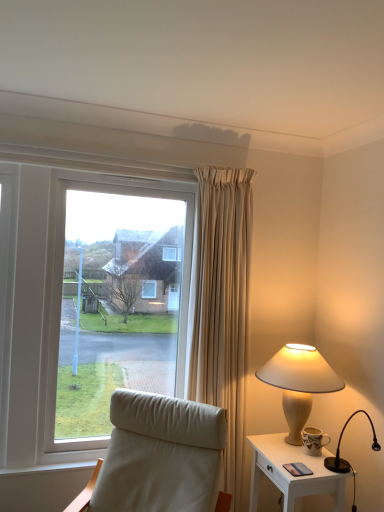
What do you see at coordinates (346, 460) in the screenshot? This screenshot has height=512, width=384. I see `black glossy lamp at right, placed as the 2th lamp when sorted from back to front` at bounding box center [346, 460].

Image resolution: width=384 pixels, height=512 pixels. I want to click on black glossy lamp at right, which is the first lamp in front-to-back order, so click(346, 460).

Could you tell me if white glossy nightstand at lower right is turned towards leather-like chair at lower left?

Yes.

Is white glossy nightstand at lower right positioned behind leather-like chair at lower left?

Yes.

Is point (287, 504) positioned after point (89, 506)?

Yes.

From the image's perspective, is black glossy lamp at right, placed as the 2th lamp when sorted from back to front, located beneath white glossy nightstand at lower right?

Actually, black glossy lamp at right, placed as the 2th lamp when sorted from back to front, appears above white glossy nightstand at lower right in the image.

Considering the positions of point (339, 447) and point (322, 455), is point (339, 447) closer or farther from the camera than point (322, 455)?

Point (339, 447) is farther from the camera than point (322, 455).

Which of these two, black glossy lamp at right, which is the first lamp in front-to-back order, or white glossy nightstand at lower right, is thinner?

With smaller width is white glossy nightstand at lower right.

Considering the relative sizes of leather-like chair at lower left and white glossy nightstand at lower right in the image provided, is leather-like chair at lower left bigger than white glossy nightstand at lower right?

Yes.

How much distance is there between leather-like chair at lower left and white glossy nightstand at lower right?

leather-like chair at lower left is 20.94 inches from white glossy nightstand at lower right.

In the image, there is a leather-like chair at lower left. At what (x,y) coordinates should I click in order to perform the action: click on nightstand below it (from the image's perspective). Please return your answer as a coordinate pair (x, y). The image size is (384, 512). Looking at the image, I should click on (290, 474).

Can you tell me how much leather-like chair at lower left and white glossy nightstand at lower right differ in facing direction?

There is a 47.5-degree angle between the facing directions of leather-like chair at lower left and white glossy nightstand at lower right.

Does white glossy nightstand at lower right have a larger size compared to black glossy lamp at right, which is the first lamp in front-to-back order?

Yes.

From a real-world perspective, starting from the white glossy nightstand at lower right, which lamp is the 1st one vertically above it? Please provide its 2D coordinates.

[(346, 460)]

From the image's perspective, between white glossy nightstand at lower right and black glossy lamp at right, placed as the 2th lamp when sorted from back to front, who is located below?

From the image's view, white glossy nightstand at lower right is below.

What's the angular difference between white glossy nightstand at lower right and black glossy lamp at right, which is the first lamp in front-to-back order,'s facing directions?

There is a 67-degree angle between the facing directions of white glossy nightstand at lower right and black glossy lamp at right, which is the first lamp in front-to-back order.

Is leather-like chair at lower left next to matte beige lamp at right, which ranks as the 2th lamp in front-to-back order?

No, leather-like chair at lower left is not making contact with matte beige lamp at right, which ranks as the 2th lamp in front-to-back order.

Considering the positions of point (190, 404) and point (304, 397), is point (190, 404) closer or farther from the camera than point (304, 397)?

Point (190, 404).

How distant is leather-like chair at lower left from matte beige lamp at right, which ranks as the 2th lamp in front-to-back order?

A distance of 23.79 inches exists between leather-like chair at lower left and matte beige lamp at right, which ranks as the 2th lamp in front-to-back order.

In the scene shown: Would you say leather-like chair at lower left is outside matte beige lamp at right, marked as the 1th lamp in a back-to-front arrangement?

leather-like chair at lower left lies outside matte beige lamp at right, marked as the 1th lamp in a back-to-front arrangement,'s area.

Between matte beige lamp at right, which ranks as the 2th lamp in front-to-back order, and white glossy nightstand at lower right, which one has larger size?

white glossy nightstand at lower right is bigger.

In the scene shown: Can we say matte beige lamp at right, which ranks as the 2th lamp in front-to-back order, lies outside white glossy nightstand at lower right?

Yes.

Considering the positions of objects matte beige lamp at right, which ranks as the 2th lamp in front-to-back order, and white glossy nightstand at lower right in the image provided, who is more to the left, matte beige lamp at right, which ranks as the 2th lamp in front-to-back order, or white glossy nightstand at lower right?

Positioned to the left is white glossy nightstand at lower right.

Are matte beige lamp at right, marked as the 1th lamp in a back-to-front arrangement, and white glossy nightstand at lower right located far from each other?

No, matte beige lamp at right, marked as the 1th lamp in a back-to-front arrangement, is not far from white glossy nightstand at lower right.

Where is `lamp that is the 1st one above the leather-like chair at lower left (from a real-world perspective)`? This screenshot has height=512, width=384. lamp that is the 1st one above the leather-like chair at lower left (from a real-world perspective) is located at coordinates (346, 460).

Is black glossy lamp at right, placed as the 2th lamp when sorted from back to front, at the right side of leather-like chair at lower left?

Correct, you'll find black glossy lamp at right, placed as the 2th lamp when sorted from back to front, to the right of leather-like chair at lower left.

How many degrees apart are the facing directions of black glossy lamp at right, which is the first lamp in front-to-back order, and leather-like chair at lower left?

The angle between the facing direction of black glossy lamp at right, which is the first lamp in front-to-back order, and the facing direction of leather-like chair at lower left is 19.5 degrees.

Is black glossy lamp at right, which is the first lamp in front-to-back order, situated inside leather-like chair at lower left or outside?

black glossy lamp at right, which is the first lamp in front-to-back order, is located beyond the bounds of leather-like chair at lower left.

In the image, there is a leather-like chair at lower left. Where is `nightstand below it (from the image's perspective)`? The width and height of the screenshot is (384, 512). nightstand below it (from the image's perspective) is located at coordinates (290, 474).

You are a GUI agent. You are given a task and a screenshot of the screen. Output one action in this format:
    pyautogui.click(x=<x>, y=<y>)
    Task: Click on the lamp in front of the white glossy nightstand at lower right
    This screenshot has width=384, height=512.
    Given the screenshot: What is the action you would take?
    pyautogui.click(x=346, y=460)

From the image, which object appears to be farther from white glossy nightstand at lower right, leather-like chair at lower left or black glossy lamp at right, placed as the 2th lamp when sorted from back to front?

leather-like chair at lower left.

Looking at the image, which one is located further to black glossy lamp at right, placed as the 2th lamp when sorted from back to front, matte beige lamp at right, marked as the 1th lamp in a back-to-front arrangement, or white glossy nightstand at lower right?

Based on the image, matte beige lamp at right, marked as the 1th lamp in a back-to-front arrangement, appears to be further to black glossy lamp at right, placed as the 2th lamp when sorted from back to front.

When comparing their distances from white glossy nightstand at lower right, does black glossy lamp at right, placed as the 2th lamp when sorted from back to front, or matte beige lamp at right, which ranks as the 2th lamp in front-to-back order, seem further?

The object further to white glossy nightstand at lower right is matte beige lamp at right, which ranks as the 2th lamp in front-to-back order.

In the scene shown: Based on their spatial positions, is leather-like chair at lower left or matte beige lamp at right, which ranks as the 2th lamp in front-to-back order, closer to black glossy lamp at right, placed as the 2th lamp when sorted from back to front?

Among the two, matte beige lamp at right, which ranks as the 2th lamp in front-to-back order, is located nearer to black glossy lamp at right, placed as the 2th lamp when sorted from back to front.

Based on their spatial positions, is matte beige lamp at right, which ranks as the 2th lamp in front-to-back order, or black glossy lamp at right, placed as the 2th lamp when sorted from back to front, closer to white glossy nightstand at lower right?

Based on the image, black glossy lamp at right, placed as the 2th lamp when sorted from back to front, appears to be nearer to white glossy nightstand at lower right.

Looking at the image, which one is located further to leather-like chair at lower left, white glossy nightstand at lower right or black glossy lamp at right, placed as the 2th lamp when sorted from back to front?

black glossy lamp at right, placed as the 2th lamp when sorted from back to front.

Looking at the image, which one is located further to matte beige lamp at right, marked as the 1th lamp in a back-to-front arrangement, white glossy nightstand at lower right or leather-like chair at lower left?

leather-like chair at lower left is positioned further to the anchor matte beige lamp at right, marked as the 1th lamp in a back-to-front arrangement.

Which object lies further to the anchor point leather-like chair at lower left, white glossy nightstand at lower right or matte beige lamp at right, which ranks as the 2th lamp in front-to-back order?

Among the two, matte beige lamp at right, which ranks as the 2th lamp in front-to-back order, is located further to leather-like chair at lower left.

Locate an element on the screen. This screenshot has height=512, width=384. nightstand between leather-like chair at lower left and matte beige lamp at right, which ranks as the 2th lamp in front-to-back order, in the horizontal direction is located at coordinates (290, 474).

In order to click on lamp that lies between matte beige lamp at right, marked as the 1th lamp in a back-to-front arrangement, and white glossy nightstand at lower right from top to bottom in this screenshot , I will do `click(346, 460)`.

Where is `nightstand between leather-like chair at lower left and black glossy lamp at right, placed as the 2th lamp when sorted from back to front, from left to right`? Image resolution: width=384 pixels, height=512 pixels. nightstand between leather-like chair at lower left and black glossy lamp at right, placed as the 2th lamp when sorted from back to front, from left to right is located at coordinates 290,474.

Where is `lamp between leather-like chair at lower left and black glossy lamp at right, which is the first lamp in front-to-back order`? The height and width of the screenshot is (512, 384). lamp between leather-like chair at lower left and black glossy lamp at right, which is the first lamp in front-to-back order is located at coordinates (299, 383).